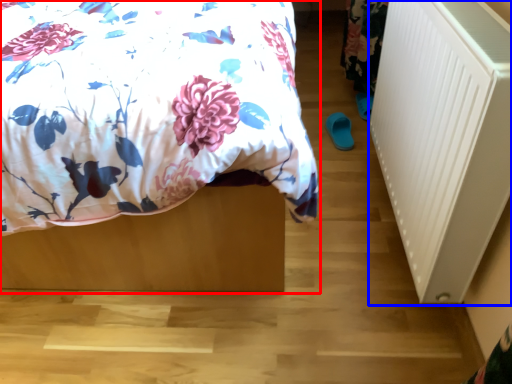
Question: Which point is further to the camera, bed (highlighted by a red box) or radiator (highlighted by a blue box)?

Choices:
 (A) bed
 (B) radiator

Answer: (B)